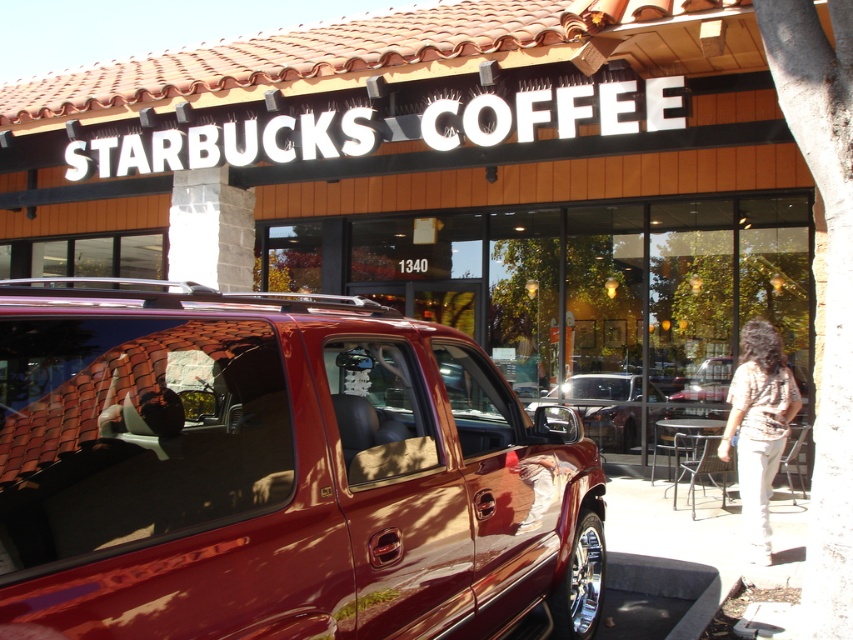
You are a delivery person trying to park your vehicle next to the shiny metallic minivan at center and the beige fabric shirt at lower right. Which vehicle has a wider body for parking consideration?

The shiny metallic minivan at center has a wider body than the beige fabric shirt at lower right, so it requires more space for parking.

You are a customer standing in front of the Starbucks Coffee shop. You see the matte black sign at center and the beige fabric shirt at lower right. Which object is located higher in the image?

The matte black sign at center is positioned over the beige fabric shirt at lower right, so it is higher in the image.